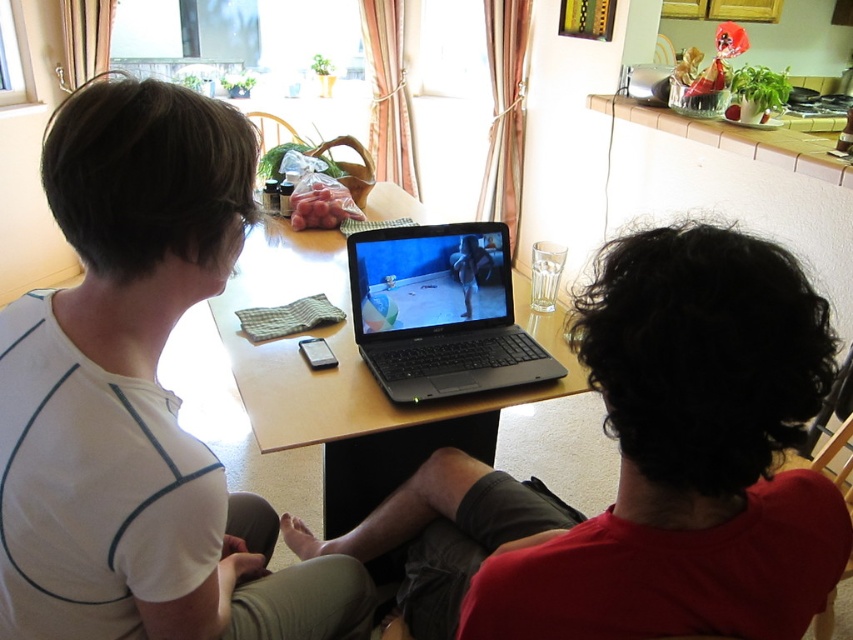
Is the position of wooden table at center more distant than that of black matte laptop at center?

That is False.

Is wooden table at center above black matte laptop at center?

Yes, wooden table at center is above black matte laptop at center.

Does point (303, 362) lie behind point (482, 253)?

No, it is in front of (482, 253).

Identify the location of wooden table at center. Image resolution: width=853 pixels, height=640 pixels. (354, 380).

In the scene shown: Between white matte shirt at left and black matte laptop at center, which one has less height?

black matte laptop at center

Between point (83, 138) and point (554, 372), which one is positioned in front?

Point (83, 138) is in front.

Image resolution: width=853 pixels, height=640 pixels. Identify the location of white matte shirt at left. (138, 397).

Where is `white matte shirt at left`? This screenshot has height=640, width=853. white matte shirt at left is located at coordinates (138, 397).

Is white matte shirt at upper left further to the viewer compared to white matte shirt at left?

No, white matte shirt at upper left is in front of white matte shirt at left.

Is white matte shirt at upper left taller than white matte shirt at left?

Incorrect, white matte shirt at upper left's height is not larger of white matte shirt at left's.

Which is in front, point (697, 513) or point (228, 563)?

Positioned in front is point (697, 513).

Locate an element on the screen. white matte shirt at upper left is located at coordinates (643, 468).